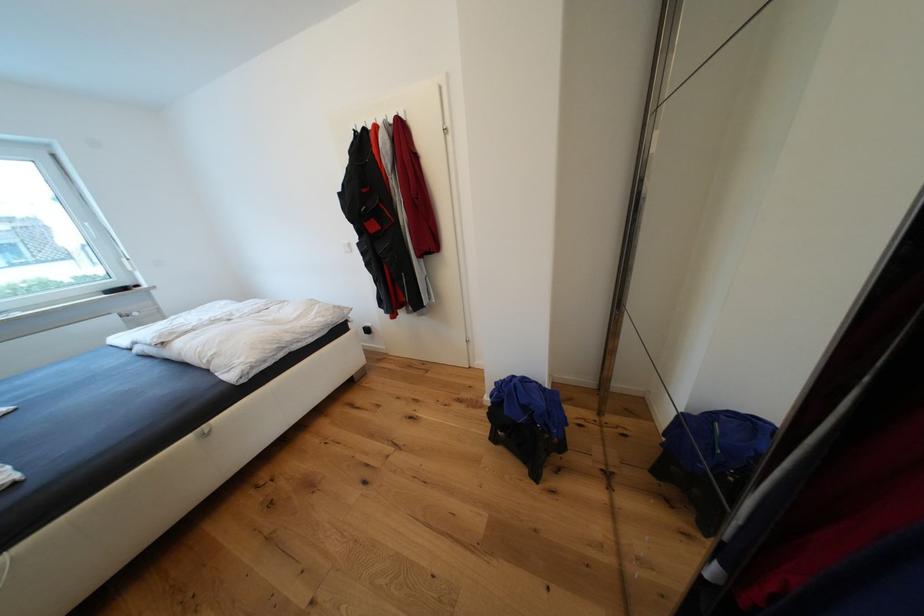
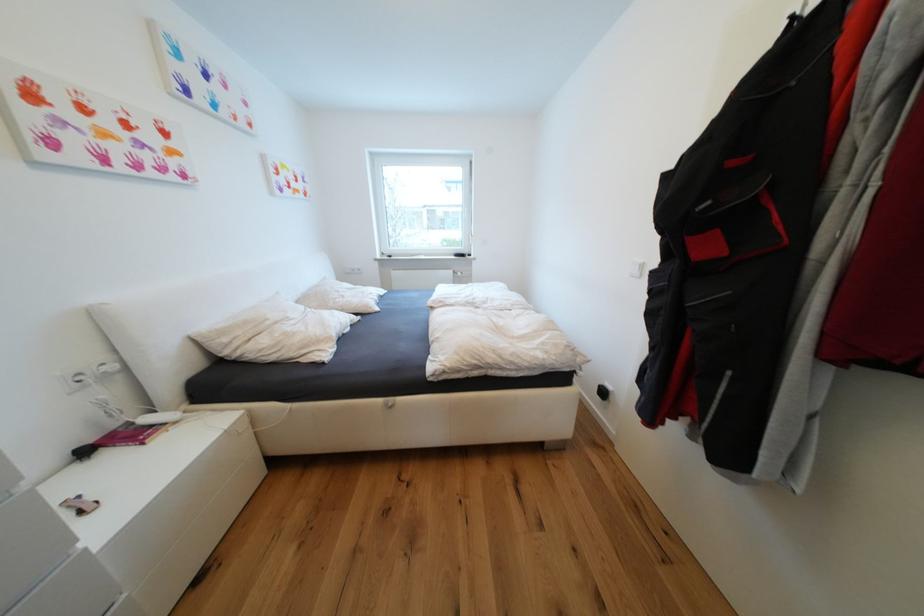
Question: The images are taken continuously from a first-person perspective. In which direction is your viewpoint rotating?

Choices:
 (A) Left
 (B) Right
 (C) Up
 (D) Down

Answer: (A)